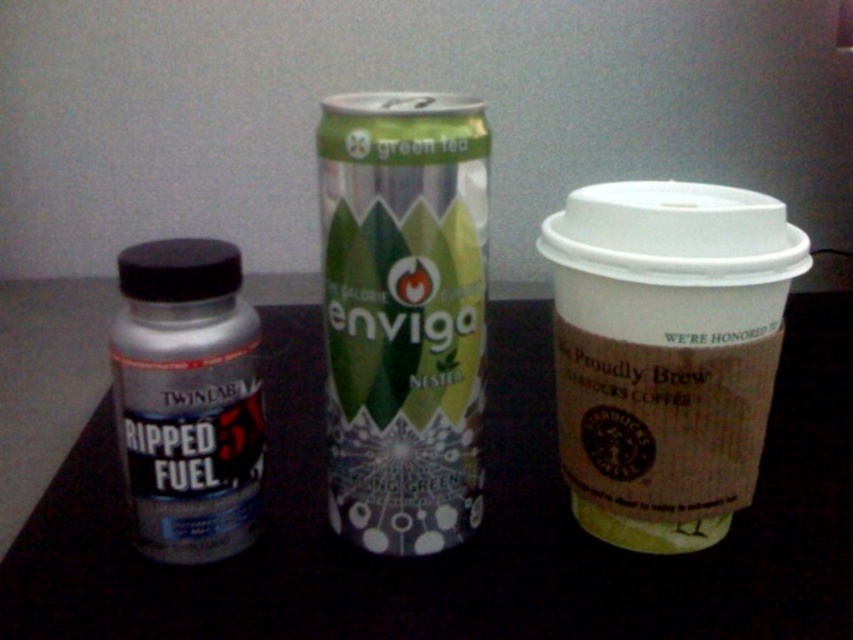
Question: Which point is farther to the camera?

Choices:
 (A) white paper cup at right
 (B) silver metallic bottle at left
 (C) black plastic bottle at left

Answer: (B)

Question: Does white paper cup at right have a larger size compared to green matte can at center?

Choices:
 (A) no
 (B) yes

Answer: (A)

Question: Which object is positioned farthest from the white paper cup at right?

Choices:
 (A) black plastic bottle at left
 (B) green matte can at center

Answer: (A)

Question: Where is green matte can at center located in relation to silver metallic bottle at left in the image?

Choices:
 (A) left
 (B) right

Answer: (B)

Question: Does black plastic bottle at left come in front of silver metallic bottle at left?

Choices:
 (A) no
 (B) yes

Answer: (B)

Question: Which point appears closest to the camera in this image?

Choices:
 (A) (125, 330)
 (B) (416, 220)
 (C) (636, 513)
 (D) (286, 392)

Answer: (B)